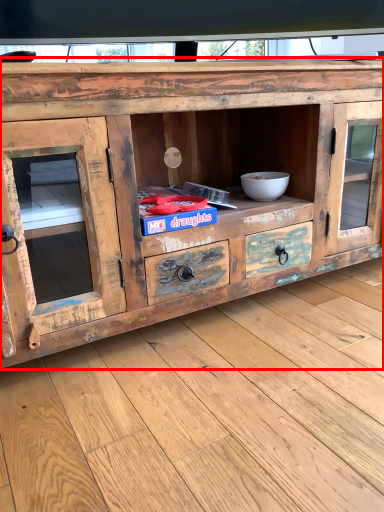
Question: From the image's perspective, where is chest of drawers (annotated by the red box) located in relation to bowl in the image?

Choices:
 (A) below
 (B) above

Answer: (B)